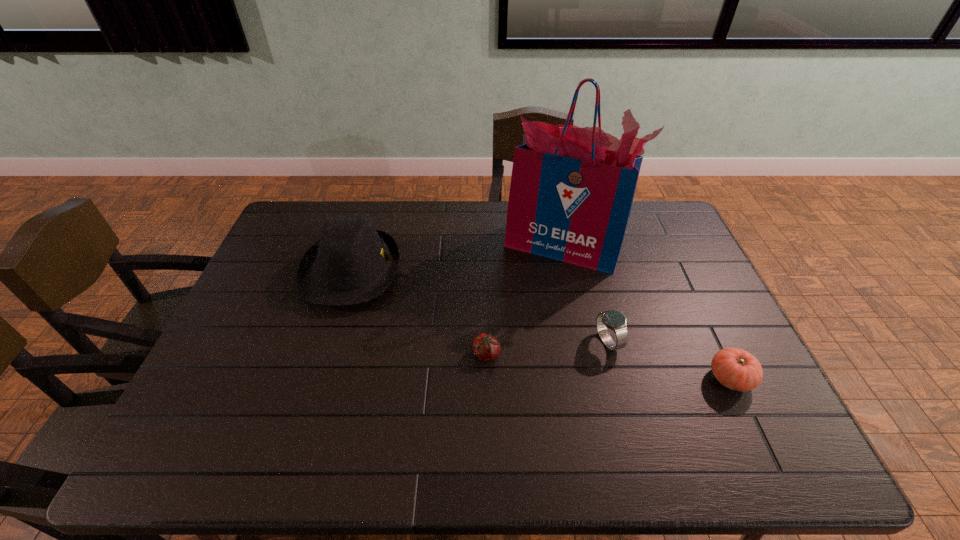
This screenshot has height=540, width=960. In the image, there is a desktop. In order to click on blank space at the left edge in this screenshot , I will do `click(278, 254)`.

Where is `vacant space at the near left corner of the desktop`? The height and width of the screenshot is (540, 960). vacant space at the near left corner of the desktop is located at coordinates (225, 455).

This screenshot has width=960, height=540. Find the location of `vacant area between the fourth tallest object and the tallest object`. vacant area between the fourth tallest object and the tallest object is located at coordinates (646, 312).

At what (x,y) coordinates should I click in order to perform the action: click on empty space that is in between the fourth object from right to left and the tallest object. Please return your answer as a coordinate pair (x, y). Looking at the image, I should click on (524, 300).

Locate an element on the screen. This screenshot has height=540, width=960. empty location between the shortest object and the tallest object is located at coordinates (524, 300).

Identify the location of vacant area that lies between the second object from left to right and the rightmost object. The image size is (960, 540). (609, 367).

The image size is (960, 540). Find the location of `vacant region between the left tomato and the watch`. vacant region between the left tomato and the watch is located at coordinates (547, 348).

Where is `vacant area that lies between the tallest object and the taller tomato`? The image size is (960, 540). vacant area that lies between the tallest object and the taller tomato is located at coordinates (646, 312).

Where is `free space between the right tomato and the fourth shortest object`? This screenshot has width=960, height=540. free space between the right tomato and the fourth shortest object is located at coordinates (540, 325).

Identify the location of free space between the watch and the right tomato. The width and height of the screenshot is (960, 540). (669, 360).